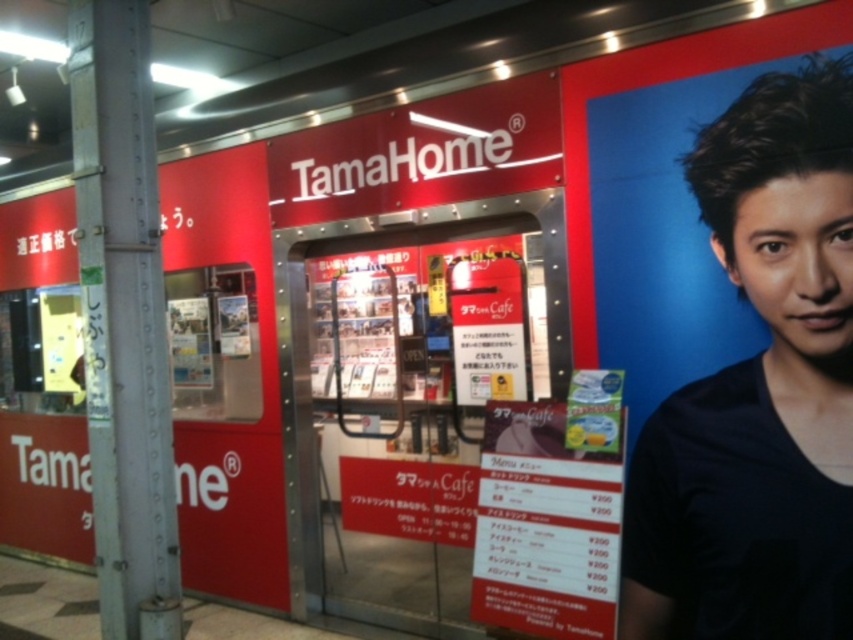
Between black matte shirt at right and metallic gray pole at left, which one is positioned higher?

metallic gray pole at left

Can you confirm if black matte shirt at right is bigger than metallic gray pole at left?

Indeed, black matte shirt at right has a larger size compared to metallic gray pole at left.

Describe the element at coordinates (759, 388) in the screenshot. I see `black matte shirt at right` at that location.

At what (x,y) coordinates should I click in order to perform the action: click on black matte shirt at right. Please return your answer as a coordinate pair (x, y). This screenshot has width=853, height=640. Looking at the image, I should click on (759, 388).